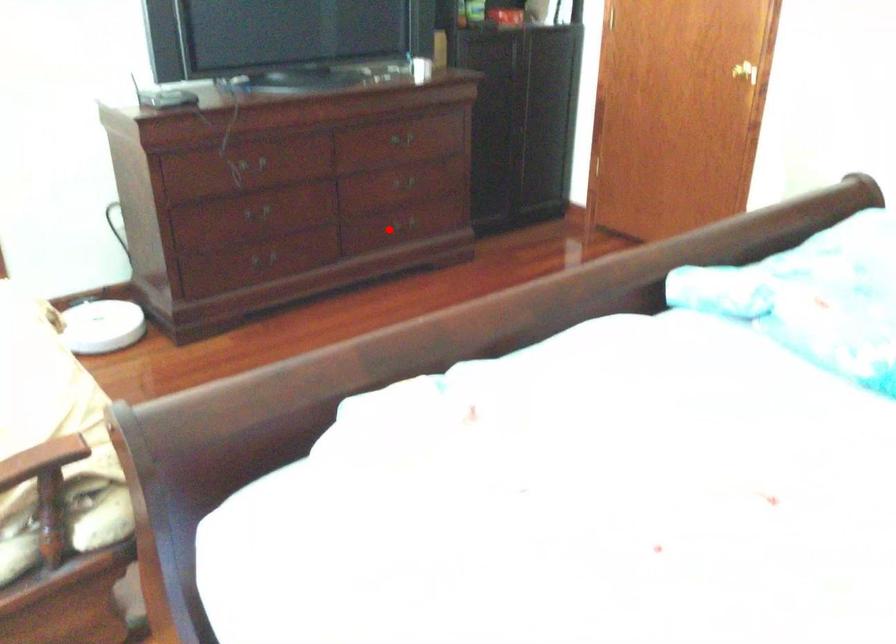
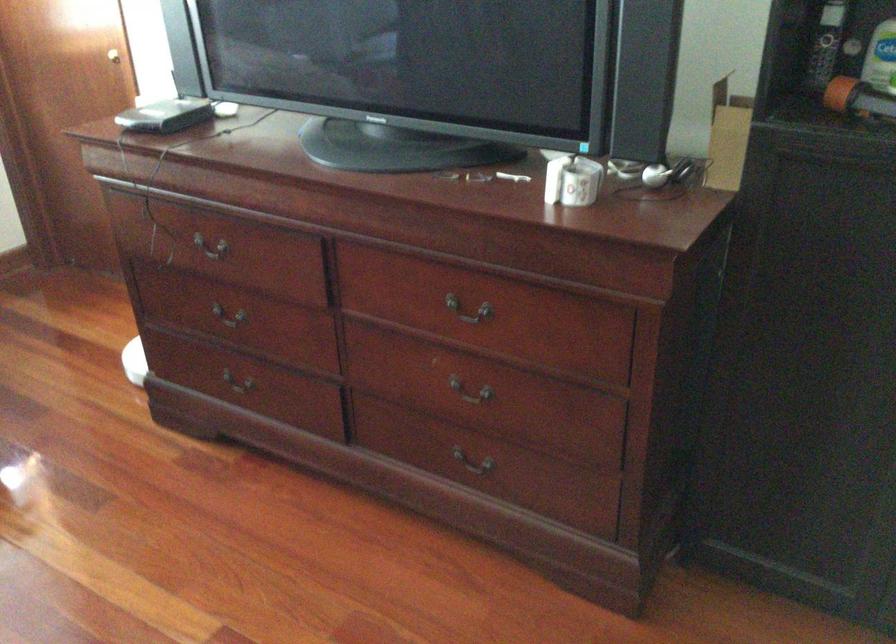
The point at the highlighted location is marked in the first image. Where is the corresponding point in the second image?

(471, 466)